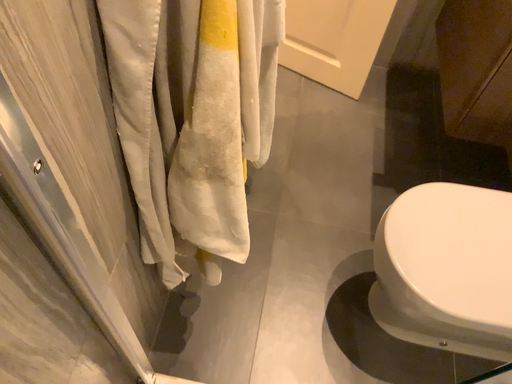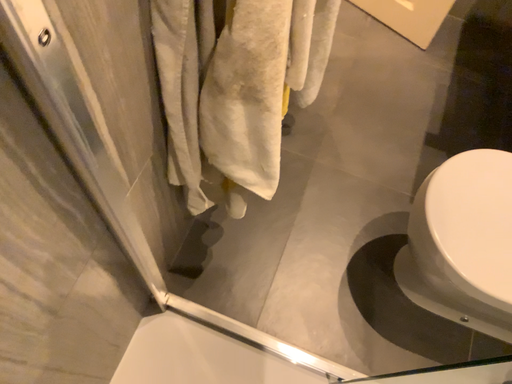
Question: How did the camera likely rotate when shooting the video?

Choices:
 (A) rotated downward
 (B) rotated upward

Answer: (A)